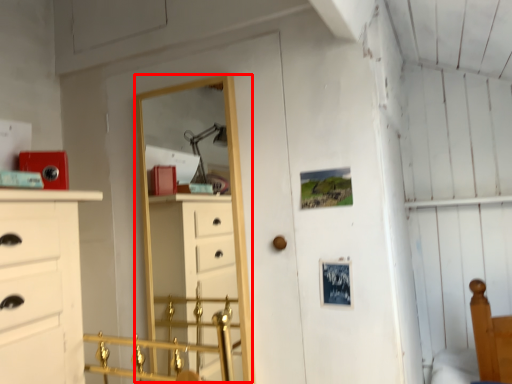
Question: Observing the image, what is the correct spatial positioning of mirror (annotated by the red box) in reference to door handle?

Choices:
 (A) left
 (B) right

Answer: (A)